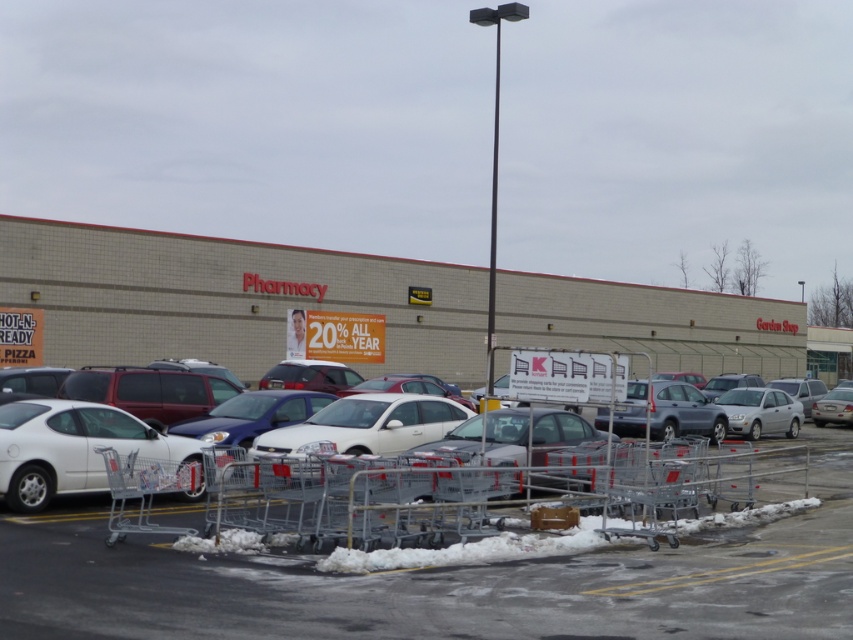
Question: Can you confirm if silver metallic shopping cart at lower left is smaller than silver metallic sedan at center?

Choices:
 (A) no
 (B) yes

Answer: (B)

Question: Where is white matte car at lower left located in relation to silver metallic shopping cart at lower left in the image?

Choices:
 (A) left
 (B) right

Answer: (B)

Question: Is white matte car at left to the left of silver metallic shopping cart at lower left from the viewer's perspective?

Choices:
 (A) yes
 (B) no

Answer: (A)

Question: Which object is closer to the camera taking this photo?

Choices:
 (A) silver metallic sedan at center-right
 (B) silver metallic shopping cart at lower left
 (C) silver metallic sedan at center
 (D) white matte car at lower left

Answer: (B)

Question: Which of these objects is positioned closest to the silver metallic sedan at center-right?

Choices:
 (A) white matte car at left
 (B) white matte car at lower left

Answer: (B)

Question: Which object is positioned farthest from the silver metallic shopping cart at lower left?

Choices:
 (A) white matte car at left
 (B) silver metallic sedan at center-right

Answer: (B)